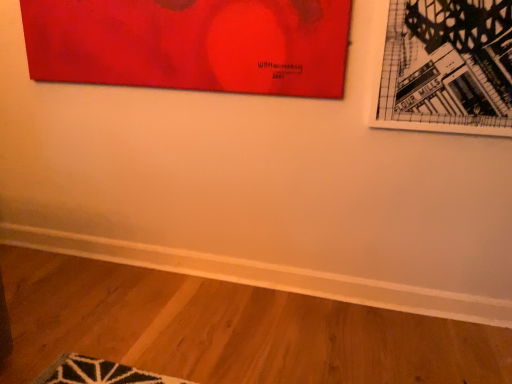
I want to click on vacant location below matte red painting at upper left, the first picture frame in the left-to-right sequence (from a real-world perspective), so click(208, 249).